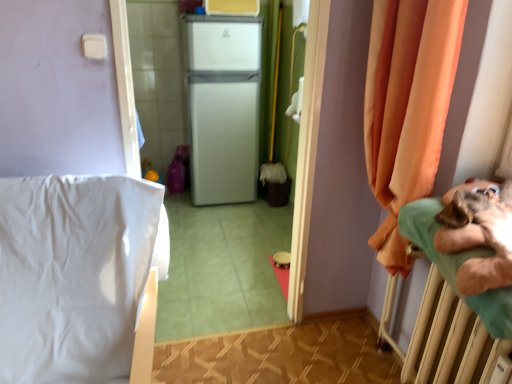
What do you see at coordinates (450, 298) in the screenshot?
I see `green fabric hospital bed at right` at bounding box center [450, 298].

Where is `white matte refrigerator at center`? The height and width of the screenshot is (384, 512). white matte refrigerator at center is located at coordinates (223, 106).

Does point (193, 132) come in front of point (22, 199)?

No, it is behind (22, 199).

Looking at this image, is white matte refrigerator at center located outside white smooth bedsheet at left?

white matte refrigerator at center lies outside white smooth bedsheet at left's area.

Between green fabric hospital bed at right and white matte refrigerator at center, which one has larger width?

With larger width is green fabric hospital bed at right.

Would you say green fabric hospital bed at right is inside or outside white matte refrigerator at center?

green fabric hospital bed at right is outside white matte refrigerator at center.

Locate an element on the screen. hospital bed on the right of white matte refrigerator at center is located at coordinates (450, 298).

Is white matte refrigerator at center located within white smooth bedsheet at left?

No, white matte refrigerator at center is not surrounded by white smooth bedsheet at left.

From a real-world perspective, is white smooth bedsheet at left below white matte refrigerator at center?

Result: Indeed, from a real-world perspective, white smooth bedsheet at left is positioned beneath white matte refrigerator at center.

Locate an element on the screen. appliance that is behind the white smooth bedsheet at left is located at coordinates (223, 106).

Between white smooth bedsheet at left and white matte refrigerator at center, which one appears on the left side from the viewer's perspective?

Positioned to the left is white smooth bedsheet at left.

Who is bigger, white matte refrigerator at center or green fabric hospital bed at right?

white matte refrigerator at center is bigger.

From the image's perspective, is white matte refrigerator at center above or below green fabric hospital bed at right?

Clearly, from the image's perspective, white matte refrigerator at center is above green fabric hospital bed at right.

How different are the orientations of white matte refrigerator at center and green fabric hospital bed at right in degrees?

They differ by 90 degrees in their facing directions.

Considering the sizes of objects white matte refrigerator at center and green fabric hospital bed at right in the image provided, who is taller, white matte refrigerator at center or green fabric hospital bed at right?

Standing taller between the two is white matte refrigerator at center.

Considering the relative sizes of orange fabric curtain at right and white matte refrigerator at center in the image provided, is orange fabric curtain at right taller than white matte refrigerator at center?

No, orange fabric curtain at right is not taller than white matte refrigerator at center.

Which object is closer to the camera, orange fabric curtain at right or white matte refrigerator at center?

orange fabric curtain at right.

You are a GUI agent. You are given a task and a screenshot of the screen. Output one action in this format:
    pyautogui.click(x=<x>, y=<y>)
    Task: Click on the appliance above the orange fabric curtain at right (from the image's perspective)
    This screenshot has width=512, height=384.
    Given the screenshot: What is the action you would take?
    pyautogui.click(x=223, y=106)

Does orange fabric curtain at right have a lesser width compared to white matte refrigerator at center?

Yes.

Considering the positions of objects orange fabric curtain at right and green fabric hospital bed at right in the image provided, who is in front, orange fabric curtain at right or green fabric hospital bed at right?

Positioned in front is green fabric hospital bed at right.

From a real-world perspective, is orange fabric curtain at right under green fabric hospital bed at right?

No, from a real-world perspective, orange fabric curtain at right is not under green fabric hospital bed at right.

Is orange fabric curtain at right bigger or smaller than green fabric hospital bed at right?

Considering their sizes, orange fabric curtain at right takes up more space than green fabric hospital bed at right.

From the picture: Is orange fabric curtain at right turned away from green fabric hospital bed at right?

No, orange fabric curtain at right is not facing the opposite direction of green fabric hospital bed at right.

What's the angular difference between green fabric hospital bed at right and orange fabric curtain at right's facing directions?

green fabric hospital bed at right and orange fabric curtain at right are facing 0.000215 degrees away from each other.

Is green fabric hospital bed at right oriented towards orange fabric curtain at right?

No, green fabric hospital bed at right is not aimed at orange fabric curtain at right.

Are green fabric hospital bed at right and orange fabric curtain at right beside each other?

green fabric hospital bed at right and orange fabric curtain at right are not in contact.

Relative to orange fabric curtain at right, is green fabric hospital bed at right in front or behind?

Visually, green fabric hospital bed at right is located in front of orange fabric curtain at right.

The height and width of the screenshot is (384, 512). What are the coordinates of `sheet on the left of white matte refrigerator at center` in the screenshot? It's located at (73, 274).

You are a GUI agent. You are given a task and a screenshot of the screen. Output one action in this format:
    pyautogui.click(x=<x>, y=<y>)
    Task: Click on the hospital bed above the white matte refrigerator at center (from a real-world perspective)
    This screenshot has width=512, height=384.
    Given the screenshot: What is the action you would take?
    pyautogui.click(x=450, y=298)

Which object lies nearer to the anchor point white smooth bedsheet at left, green fabric hospital bed at right or white matte refrigerator at center?

green fabric hospital bed at right is positioned closer to the anchor white smooth bedsheet at left.

Which object lies further to the anchor point orange fabric curtain at right, white smooth bedsheet at left or white matte refrigerator at center?

white matte refrigerator at center lies further to orange fabric curtain at right than the other object.

Considering their positions, is orange fabric curtain at right positioned closer to green fabric hospital bed at right than white matte refrigerator at center?

orange fabric curtain at right lies closer to green fabric hospital bed at right than the other object.

Estimate the real-world distances between objects in this image. Which object is closer to orange fabric curtain at right, green fabric hospital bed at right or white matte refrigerator at center?

green fabric hospital bed at right is closer to orange fabric curtain at right.

Considering their positions, is white smooth bedsheet at left positioned closer to green fabric hospital bed at right than orange fabric curtain at right?

orange fabric curtain at right is closer to green fabric hospital bed at right.

Considering their positions, is orange fabric curtain at right positioned further to white smooth bedsheet at left than green fabric hospital bed at right?

green fabric hospital bed at right lies further to white smooth bedsheet at left than the other object.

From the image, which object appears to be farther from orange fabric curtain at right, white matte refrigerator at center or green fabric hospital bed at right?

white matte refrigerator at center.

Which object lies nearer to the anchor point white smooth bedsheet at left, white matte refrigerator at center or orange fabric curtain at right?

orange fabric curtain at right lies closer to white smooth bedsheet at left than the other object.

Find the location of a particular element. The width and height of the screenshot is (512, 384). curtain between green fabric hospital bed at right and white matte refrigerator at center along the z-axis is located at coordinates (407, 107).

Locate an element on the screen. The width and height of the screenshot is (512, 384). hospital bed between white smooth bedsheet at left and white matte refrigerator at center from front to back is located at coordinates (450, 298).

Locate an element on the screen. This screenshot has width=512, height=384. curtain between white smooth bedsheet at left and white matte refrigerator at center along the z-axis is located at coordinates (407, 107).

Image resolution: width=512 pixels, height=384 pixels. Identify the location of curtain located between white smooth bedsheet at left and green fabric hospital bed at right in the left-right direction. (407, 107).